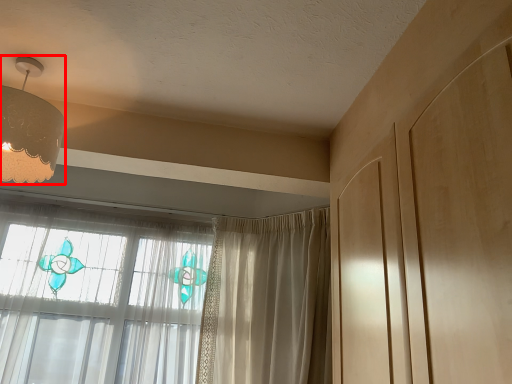
Question: From the image's perspective, where is lamp (annotated by the red box) located in relation to curtain in the image?

Choices:
 (A) above
 (B) below

Answer: (A)